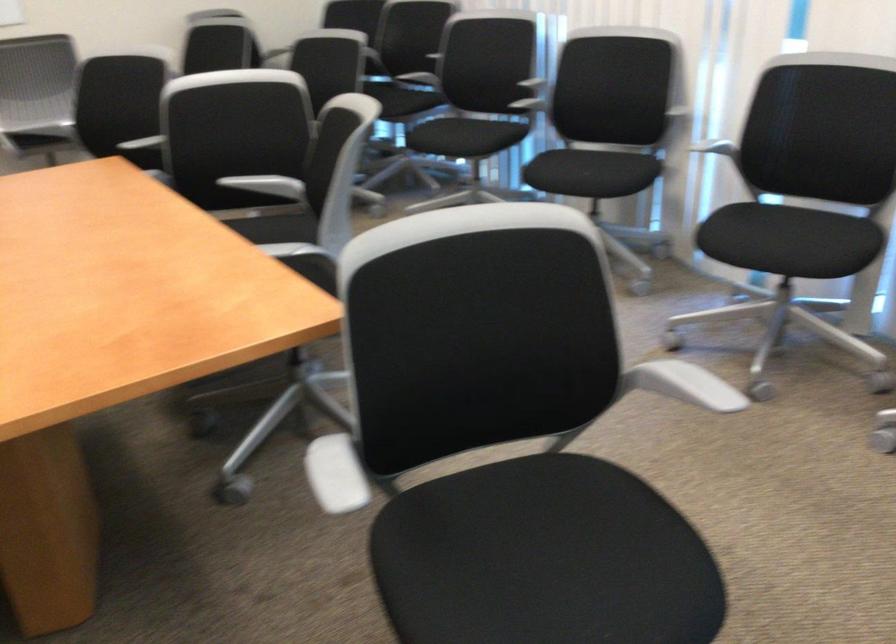
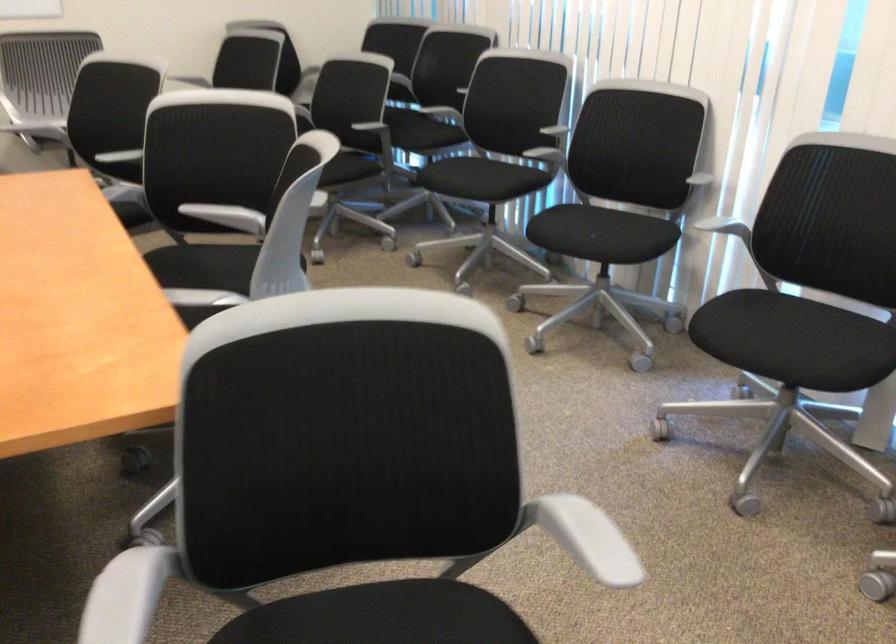
Where in the second image is the point corresponding to (668,106) from the first image?

(693, 174)